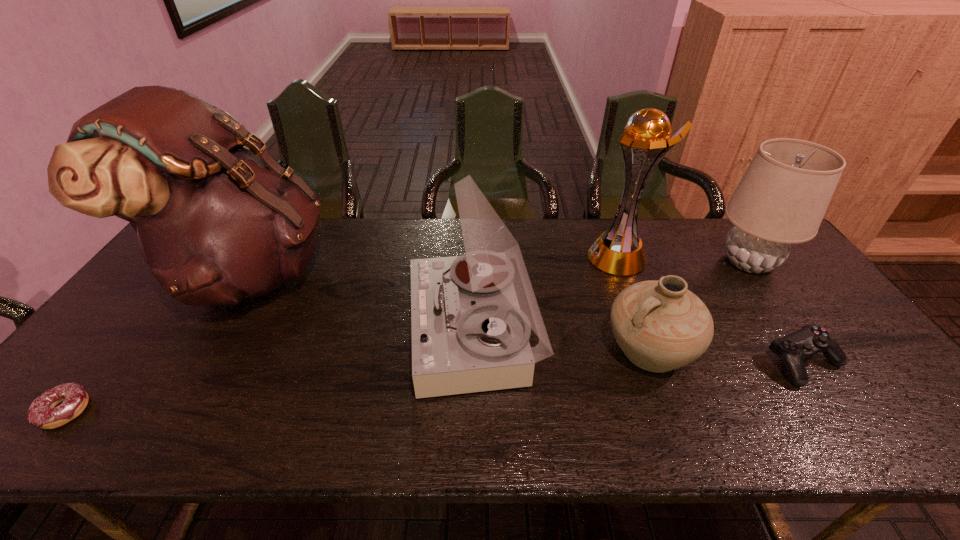
Identify the location of free spot located 0.190m on the front-facing side of the trophy. This screenshot has width=960, height=540. (528, 257).

Locate an element on the screen. The height and width of the screenshot is (540, 960). vacant area located 0.160m on the left of the lampshade is located at coordinates (660, 262).

The height and width of the screenshot is (540, 960). I want to click on free point located on the left of the record player, so click(x=312, y=330).

This screenshot has width=960, height=540. I want to click on vacant space located on the back of the third shortest object, so click(x=621, y=272).

At what (x,y) coordinates should I click in order to perform the action: click on vacant region located on the left of the second shortest object. Please return your answer as a coordinate pair (x, y). Looking at the image, I should click on (610, 362).

Locate an element on the screen. free location located 0.360m on the right of the shortest object is located at coordinates (250, 410).

Identify the location of satchel that is at the far edge. (216, 222).

You are a GUI agent. You are given a task and a screenshot of the screen. Output one action in this format:
    pyautogui.click(x=<x>, y=<y>)
    Task: Click on the trophy located in the far edge section of the desktop
    The image size is (960, 540).
    Given the screenshot: What is the action you would take?
    pyautogui.click(x=619, y=251)

Image resolution: width=960 pixels, height=540 pixels. I want to click on lampshade present at the far edge, so click(782, 198).

Find the location of a particular element. This screenshot has width=960, height=540. object that is at the near edge is located at coordinates (43, 413).